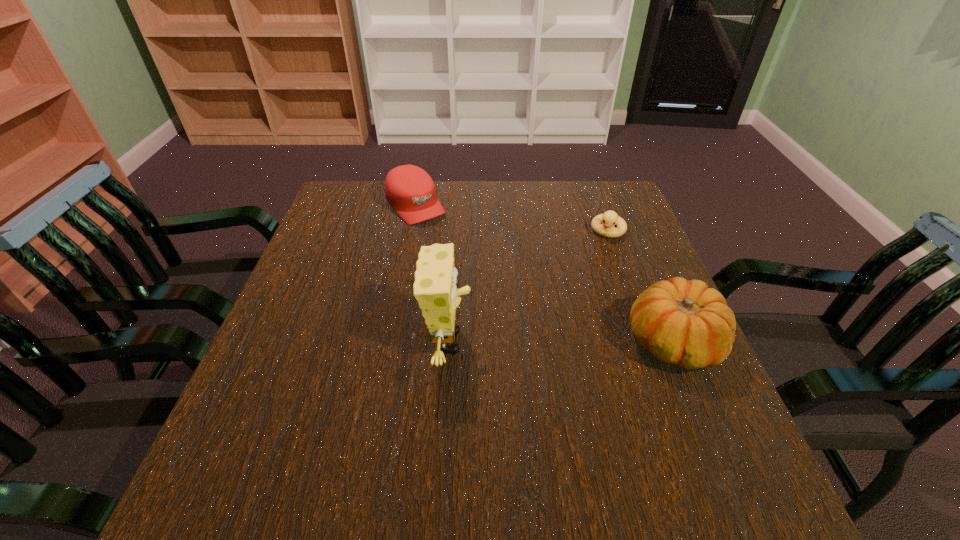
The width and height of the screenshot is (960, 540). In the image, there is a desktop. What are the coordinates of `vacant space at the right edge` in the screenshot? It's located at pyautogui.click(x=647, y=259).

Where is `free space at the near right corner`? free space at the near right corner is located at coordinates (713, 423).

Image resolution: width=960 pixels, height=540 pixels. What are the coordinates of `vacant area between the tallest object and the shortest object` in the screenshot? It's located at (528, 286).

Where is `vacant area that lies between the third shortest object and the duckling`? Image resolution: width=960 pixels, height=540 pixels. vacant area that lies between the third shortest object and the duckling is located at coordinates coord(640,286).

Image resolution: width=960 pixels, height=540 pixels. I want to click on empty location between the shortest object and the sponge, so click(528, 286).

Where is `vacant area that lies between the duckling and the tallest object`? The width and height of the screenshot is (960, 540). vacant area that lies between the duckling and the tallest object is located at coordinates (528, 286).

Find the location of a particular element. vacant space that's between the duckling and the gourd is located at coordinates (640, 286).

Where is `free space between the cap and the gourd`? Image resolution: width=960 pixels, height=540 pixels. free space between the cap and the gourd is located at coordinates (543, 274).

At what (x,y) coordinates should I click in order to perform the action: click on free space between the second shortest object and the duckling. Please return your answer as a coordinate pair (x, y). The image size is (960, 540). Looking at the image, I should click on (512, 218).

Locate an element on the screen. empty location between the sponge and the shortest object is located at coordinates (528, 286).